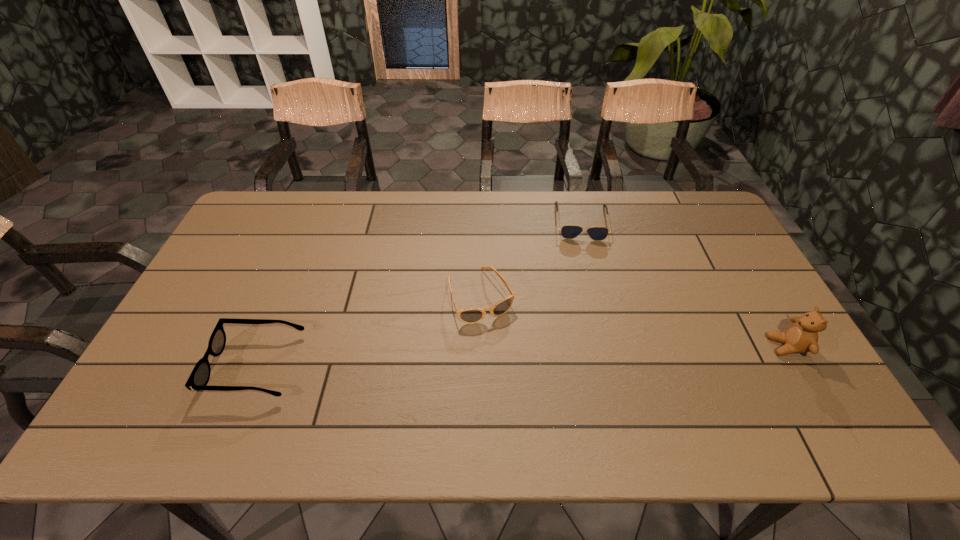
Where is `free space on the desktop that is between the spectacles and the tallest object and is positioned on the front-facing side of the second object from left to right`? free space on the desktop that is between the spectacles and the tallest object and is positioned on the front-facing side of the second object from left to right is located at coordinates (510, 356).

Locate an element on the screen. vacant space on the desktop that is between the leftmost object and the tallest object and is positioned on the front-facing side of the second object from right to left is located at coordinates (595, 353).